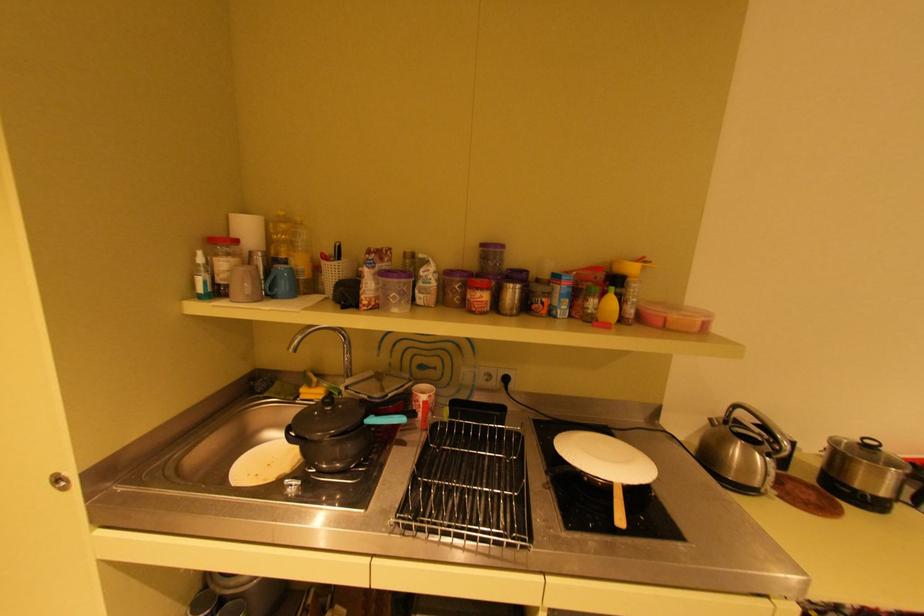
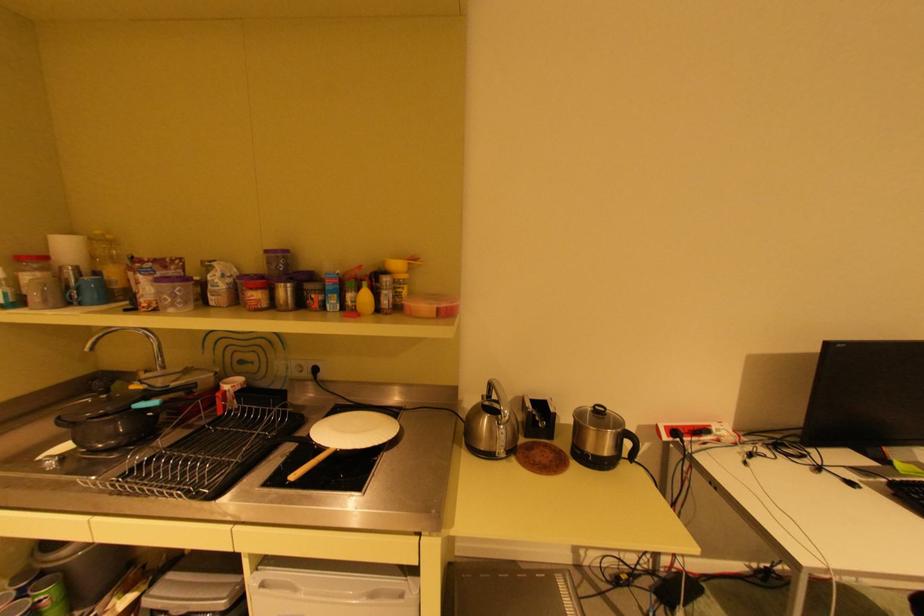
The point at (871, 440) is marked in the first image. Where is the corresponding point in the second image?

(602, 407)